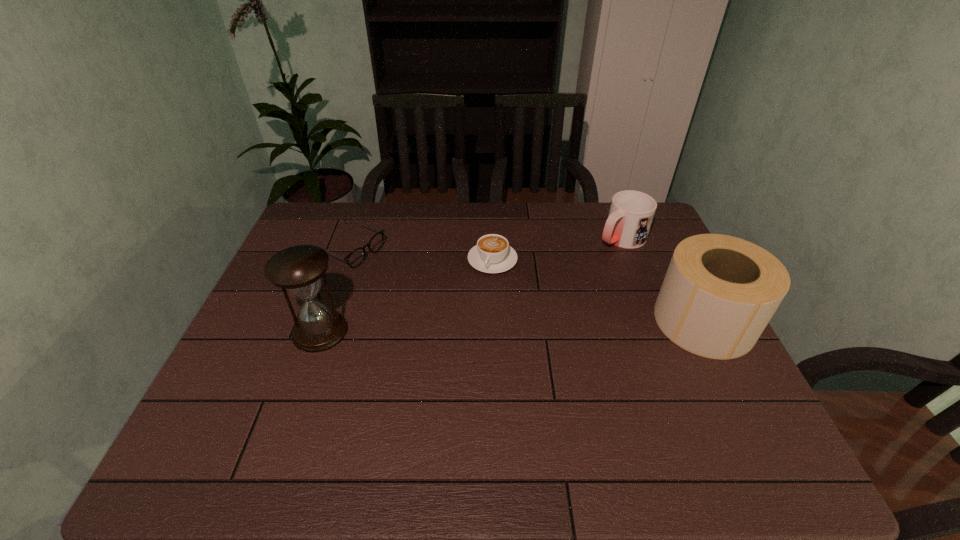
You are a GUI agent. You are given a task and a screenshot of the screen. Output one action in this format:
    pyautogui.click(x=<x>, y=<y>)
    Task: Click on the vacant space on the desktop that is between the hourglass and the second tallest object and is positioned on the side of the cappuccino with the handle
    This screenshot has height=540, width=960.
    Given the screenshot: What is the action you would take?
    coord(461,327)

Find the location of a particular element. vacant space on the desktop that is between the hourglass and the second tallest object and is positioned through the lenses of the spectacles is located at coordinates (518, 326).

The image size is (960, 540). I want to click on free space on the desktop that is between the hourglass and the toilet tissue and is positioned on the side of the mug with the handle, so click(484, 327).